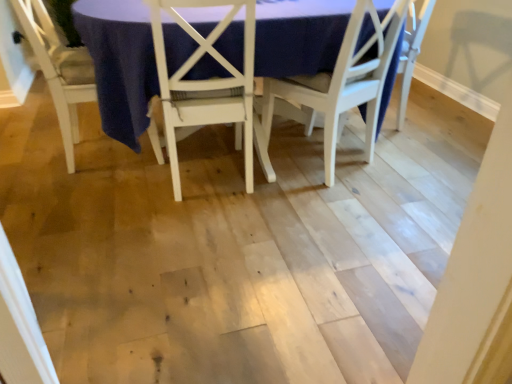
Question: Is matte white table at center further to the viewer compared to white wood chair at center, placed as the 3th chair when sorted from left to right?

Choices:
 (A) yes
 (B) no

Answer: (B)

Question: Is matte white table at center directly adjacent to white wood chair at center, placed as the 3th chair when sorted from left to right?

Choices:
 (A) no
 (B) yes

Answer: (A)

Question: Does matte white table at center have a larger size compared to white wood chair at center, which appears as the 1th chair when viewed from the right?

Choices:
 (A) no
 (B) yes

Answer: (B)

Question: From the image's perspective, does matte white table at center appear higher than white wood chair at center, which appears as the 1th chair when viewed from the right?

Choices:
 (A) no
 (B) yes

Answer: (B)

Question: Is matte white table at center not within white wood chair at center, placed as the 3th chair when sorted from left to right?

Choices:
 (A) no
 (B) yes

Answer: (B)

Question: Can you confirm if matte white table at center is shorter than white wood chair at center, placed as the 3th chair when sorted from left to right?

Choices:
 (A) no
 (B) yes

Answer: (A)

Question: Is white wood chair at center, which appears as the 1th chair when viewed from the right, at the left side of white wood chair at center, the 2th chair in the left-to-right sequence?

Choices:
 (A) no
 (B) yes

Answer: (A)

Question: Is white wood chair at center, placed as the 3th chair when sorted from left to right, wider than white wood chair at center, the 2th chair in the left-to-right sequence?

Choices:
 (A) yes
 (B) no

Answer: (B)

Question: Can you confirm if white wood chair at center, placed as the 3th chair when sorted from left to right, is taller than white wood chair at center, the 2th chair in the left-to-right sequence?

Choices:
 (A) yes
 (B) no

Answer: (B)

Question: Is the depth of white wood chair at center, placed as the 3th chair when sorted from left to right, less than that of white wood chair at center, which is the second chair in right-to-left order?

Choices:
 (A) yes
 (B) no

Answer: (B)

Question: Can you see white wood chair at center, placed as the 3th chair when sorted from left to right, touching white wood chair at center, the 2th chair in the left-to-right sequence?

Choices:
 (A) yes
 (B) no

Answer: (B)

Question: Considering the relative sizes of white wood chair at center, which appears as the 1th chair when viewed from the right, and white wood chair at center, the 2th chair in the left-to-right sequence, in the image provided, is white wood chair at center, which appears as the 1th chair when viewed from the right, shorter than white wood chair at center, the 2th chair in the left-to-right sequence,?

Choices:
 (A) yes
 (B) no

Answer: (A)

Question: From the image's perspective, would you say white wood chair at center, placed as the 3th chair when sorted from left to right, is shown under white wood chair at lower left, marked as the 1th chair in a left-to-right arrangement?

Choices:
 (A) yes
 (B) no

Answer: (A)